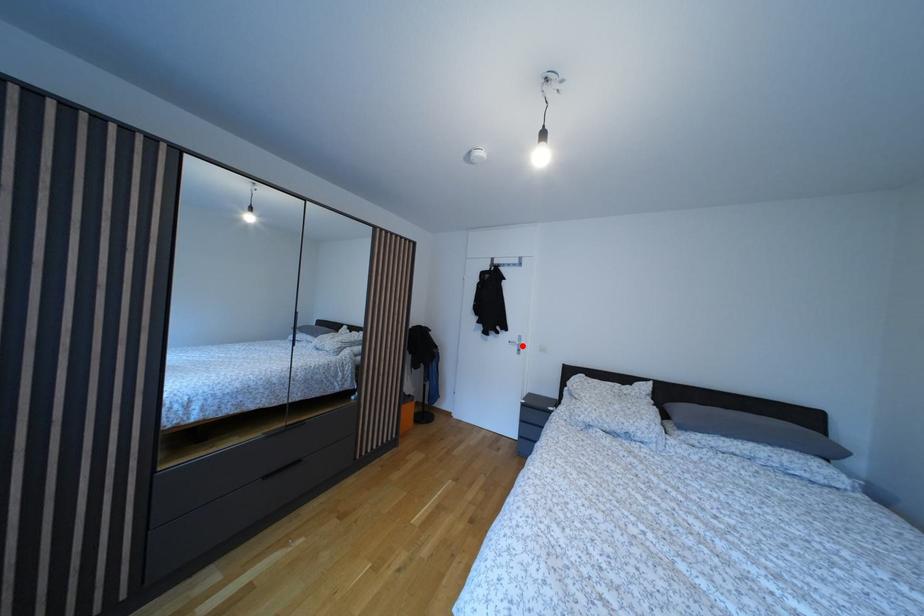
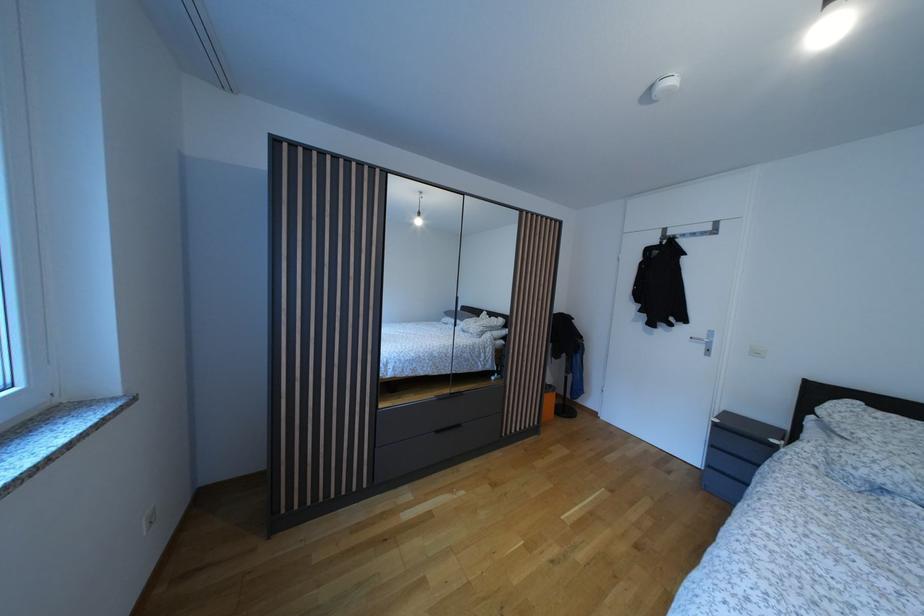
Find the pixel in the second image that matches the highlighted location in the first image.

(709, 342)